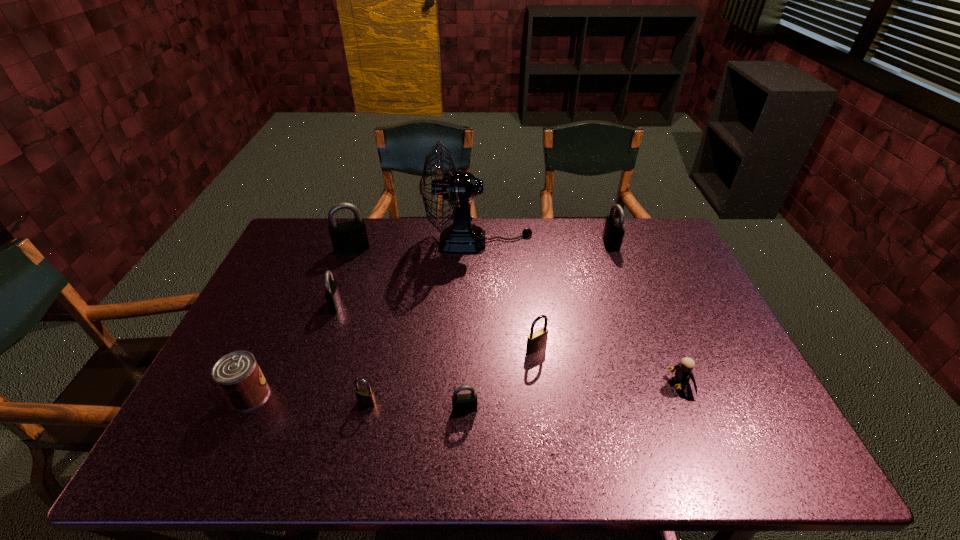
At what (x,y) coordinates should I click in order to perform the action: click on black fan. Please return your answer as a coordinate pair (x, y). Looking at the image, I should click on (459, 188).

This screenshot has width=960, height=540. I want to click on the tallest object, so click(x=459, y=188).

I want to click on the biggest black padlock, so click(349, 237).

I want to click on the tallest padlock, so click(x=349, y=237).

You are a GUI agent. You are given a task and a screenshot of the screen. Output one action in this format:
    pyautogui.click(x=<x>, y=<y>)
    Task: Click on the second biggest black padlock
    Image resolution: width=960 pixels, height=540 pixels.
    Given the screenshot: What is the action you would take?
    pyautogui.click(x=613, y=232)

The image size is (960, 540). In order to click on the rightmost padlock in this screenshot , I will do tap(613, 232).

This screenshot has height=540, width=960. What are the coordinates of `the bigger brass padlock` in the screenshot? It's located at (537, 340).

Locate an element on the screen. the right brass padlock is located at coordinates (537, 340).

Locate an element on the screen. the fourth farthest object is located at coordinates (x=332, y=294).

Find the location of a particular element. the third biggest black padlock is located at coordinates (332, 294).